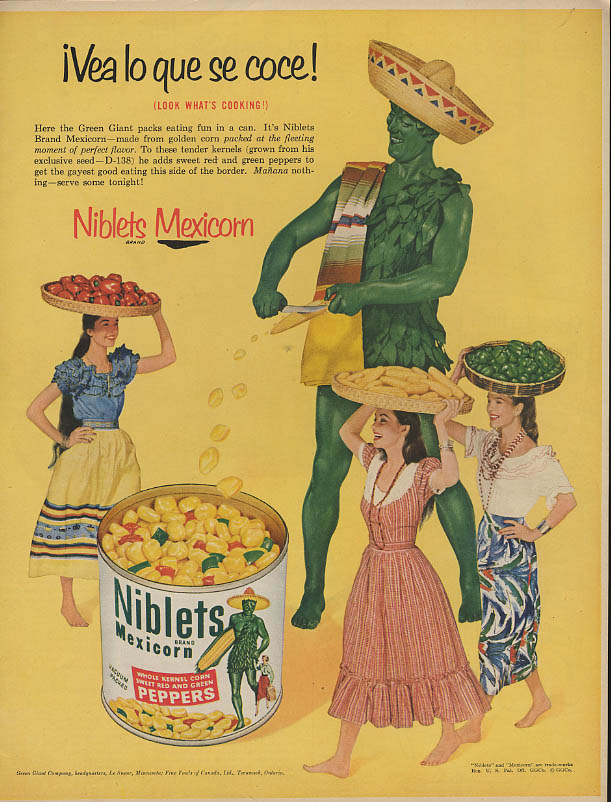
Find the location of a particular element. This screenshot has width=611, height=802. poster border is located at coordinates (541, 6), (601, 381).